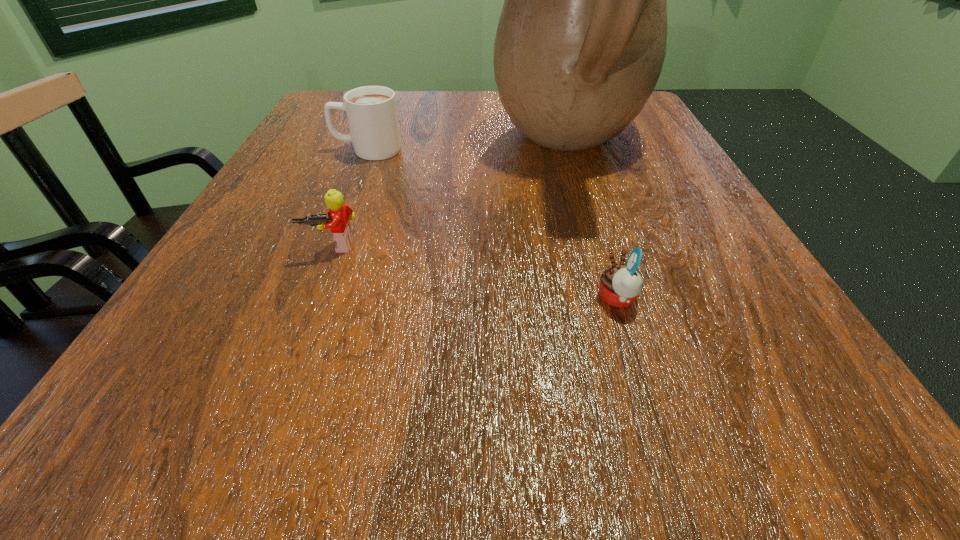
This screenshot has height=540, width=960. I want to click on free space located 0.290m in front of the third farthest object with the accessory visible, so click(x=257, y=443).

This screenshot has height=540, width=960. I want to click on free space located on the front-facing side of the muffin, so click(x=363, y=298).

Find the location of a particular element. The height and width of the screenshot is (540, 960). vacant region located on the front-facing side of the muffin is located at coordinates (540, 298).

Image resolution: width=960 pixels, height=540 pixels. Identify the location of vacant space located on the front-facing side of the muffin. (532, 298).

Locate an element on the screen. The image size is (960, 540). object that is at the far edge is located at coordinates (581, 40).

Find the location of `cappuccino at the left edge`. cappuccino at the left edge is located at coordinates [371, 111].

Find the location of `Lego that is at the left edge`. Lego that is at the left edge is located at coordinates (339, 214).

I want to click on object at the right edge, so click(581, 40).

This screenshot has width=960, height=540. I want to click on object present at the far right corner, so [581, 40].

The width and height of the screenshot is (960, 540). I want to click on vacant space at the far edge of the desktop, so click(406, 92).